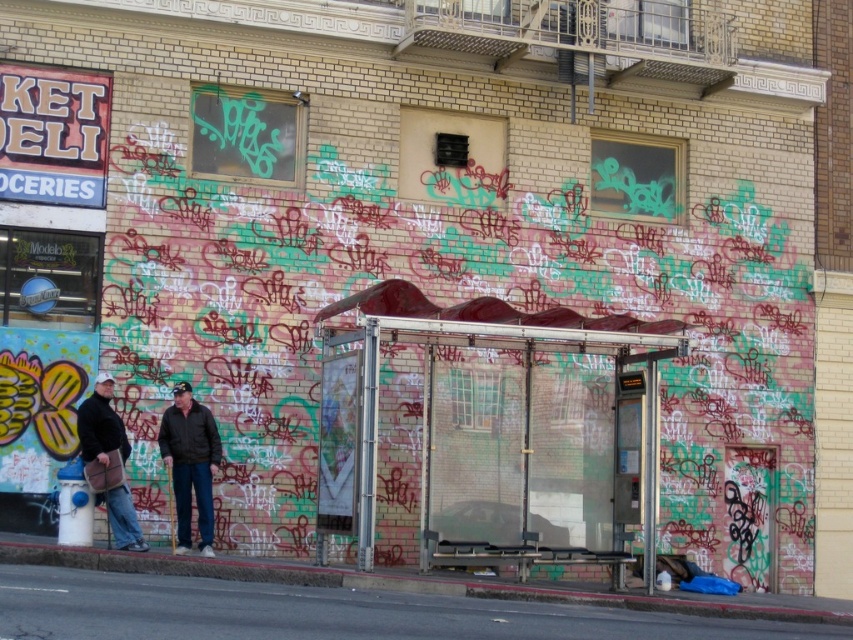
Question: Is transparent glass bus stop at center wider than dark brown leather jacket at center?

Choices:
 (A) yes
 (B) no

Answer: (A)

Question: Which of these objects is positioned farthest from the transparent glass bus stop at center?

Choices:
 (A) dark brown leather jacket at left
 (B) dark brown leather jacket at center

Answer: (A)

Question: Does transparent glass bus stop at center have a lesser width compared to dark brown leather jacket at left?

Choices:
 (A) no
 (B) yes

Answer: (A)

Question: Can you confirm if transparent glass bus stop at center is bigger than dark brown leather jacket at left?

Choices:
 (A) yes
 (B) no

Answer: (A)

Question: Which object appears farthest from the camera in this image?

Choices:
 (A) dark brown leather jacket at left
 (B) transparent glass bus stop at center
 (C) dark brown leather jacket at center

Answer: (C)

Question: Which object appears closest to the camera in this image?

Choices:
 (A) dark brown leather jacket at center
 (B) dark brown leather jacket at left
 (C) transparent glass bus stop at center

Answer: (C)